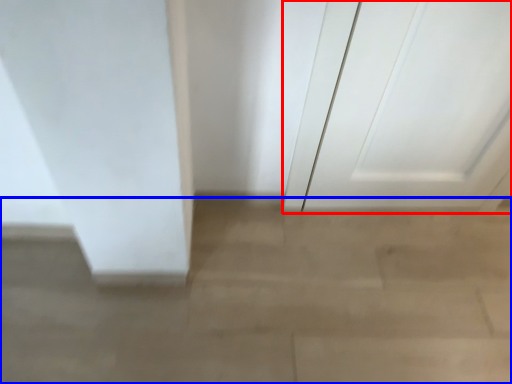
Question: Which of the following is the farthest to the observer, door (highlighted by a red box) or concrete (highlighted by a blue box)?

Choices:
 (A) door
 (B) concrete

Answer: (B)